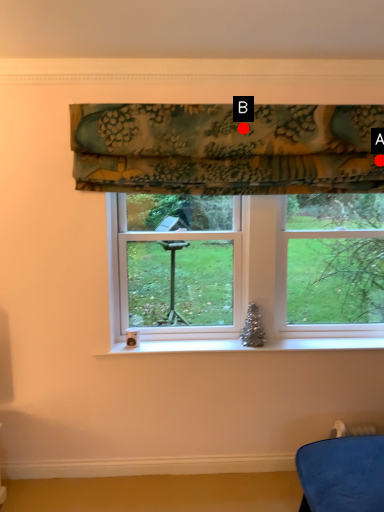
Question: Two points are circled on the image, labeled by A and B beside each circle. Which point is farther to the camera?

Choices:
 (A) A is further
 (B) B is further

Answer: (A)